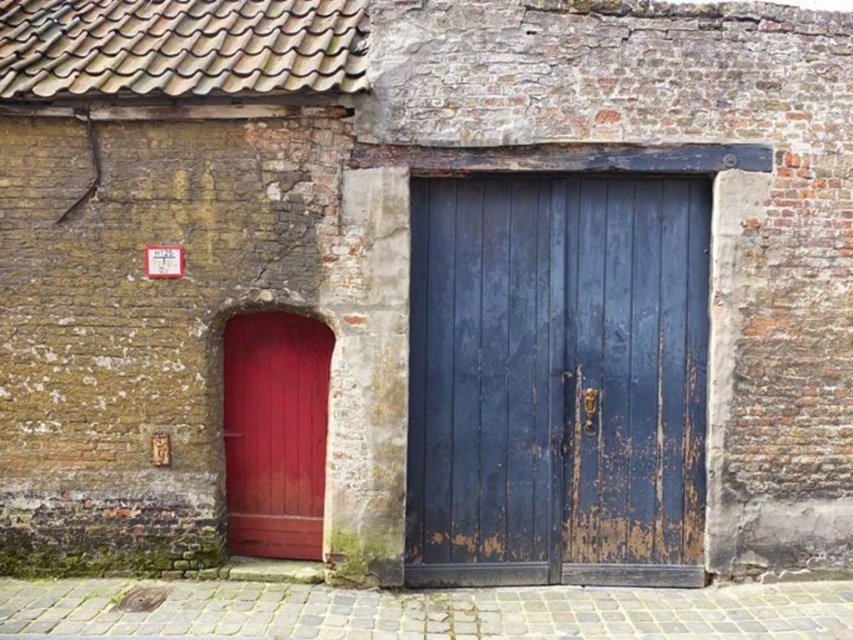
You are a delivery person trying to enter the building. You see two doors, the rusty wood door at center and the smooth glossy red door at left. Which door should you choose if you need to carry a large package that requires more space?

The rusty wood door at center has a larger size compared to the smooth glossy red door at left, so you should choose the rusty wood door at center to carry your large package through.

You are standing in front of an old building with a rusty wood door at center. To reach the door, you need to walk from the mossy base of the wall. Which direction should you move relative to the mossy area?

The rusty wood door at center is located at point (x=556, y=380), so you should move towards the center of the building from the mossy base of the wall.